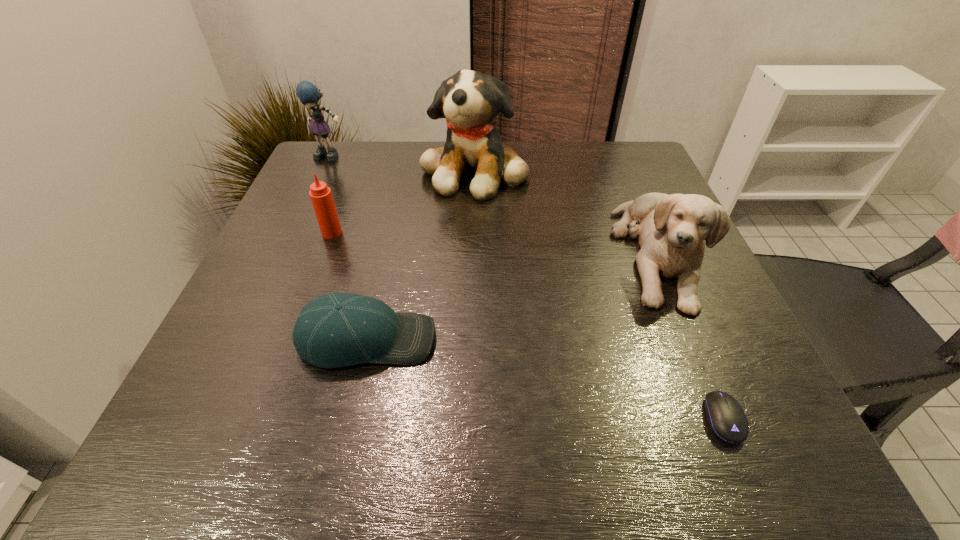
You are a GUI agent. You are given a task and a screenshot of the screen. Output one action in this format:
    pyautogui.click(x=<x>, y=<y>)
    Task: Click on the closest object to the rag doll
    The height and width of the screenshot is (540, 960).
    Given the screenshot: What is the action you would take?
    pyautogui.click(x=469, y=100)

Identify the location of free location that satisfies the following two spatial constraints: 1. on the front-facing side of the rag doll; 2. on the left side of the baseball cap. (248, 340).

I want to click on free spot that satisfies the following two spatial constraints: 1. on the front-facing side of the fifth tallest object; 2. on the right side of the leftmost object, so click(248, 340).

Find the location of a particular element. Image resolution: width=960 pixels, height=540 pixels. free space that satisfies the following two spatial constraints: 1. on the front-facing side of the rag doll; 2. on the left side of the second shortest object is located at coordinates (248, 340).